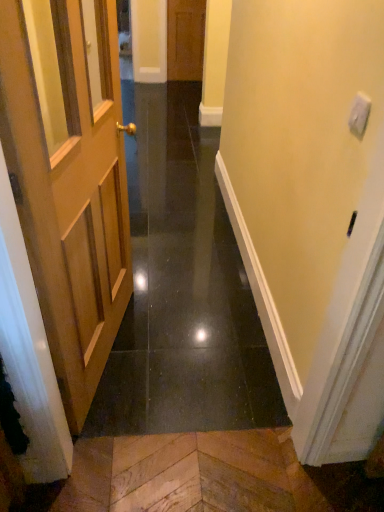
Question: Considering the positions of wooden door at center, the second door positioned from the bottom, and wooden door at left in the image, is wooden door at center, the second door positioned from the bottom, taller or shorter than wooden door at left?

Choices:
 (A) short
 (B) tall

Answer: (B)

Question: In the image, is wooden door at center, the second door positioned from the bottom, on the left side or the right side of wooden door at left?

Choices:
 (A) left
 (B) right

Answer: (B)

Question: Which is nearer to the wooden door at left?

Choices:
 (A) wooden door at center, the 2th door when ordered from front to back
 (B) light brown wooden door at left, acting as the 1th door starting from the bottom

Answer: (B)

Question: Which is nearer to the wooden door at left?

Choices:
 (A) light brown wooden door at left, the second door from the top
 (B) wooden door at center, the 2th door when ordered from front to back

Answer: (A)